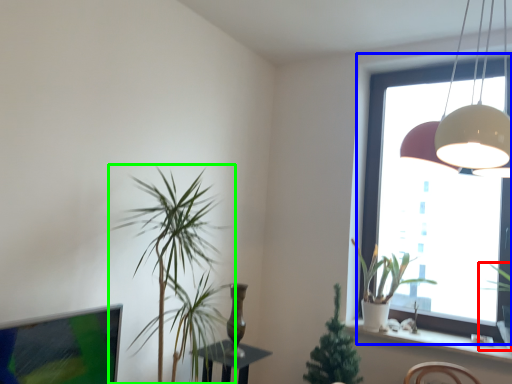
Question: Which object is positioned farthest from houseplant (highlighted by a red box)? Select from window (highlighted by a blue box) and houseplant (highlighted by a green box).

Choices:
 (A) window
 (B) houseplant

Answer: (B)